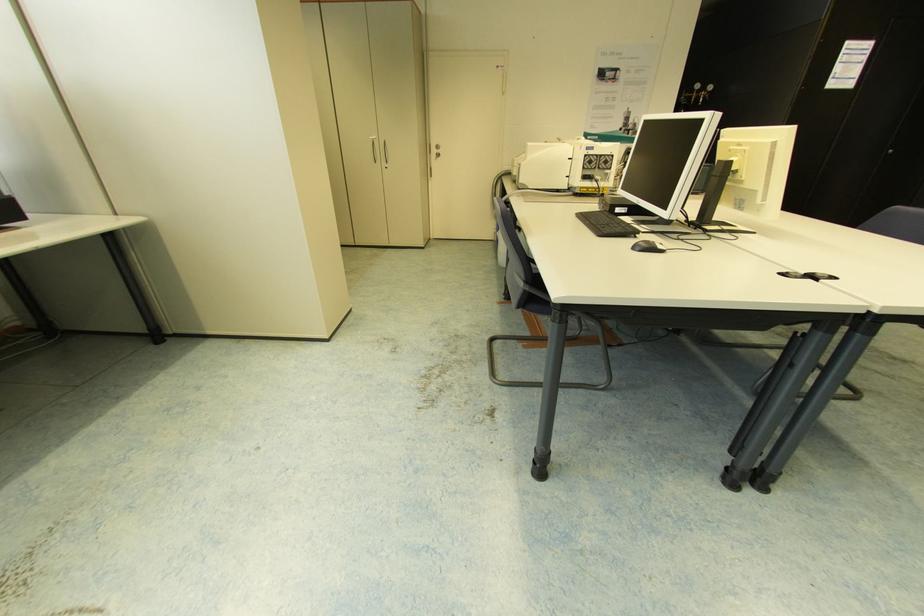
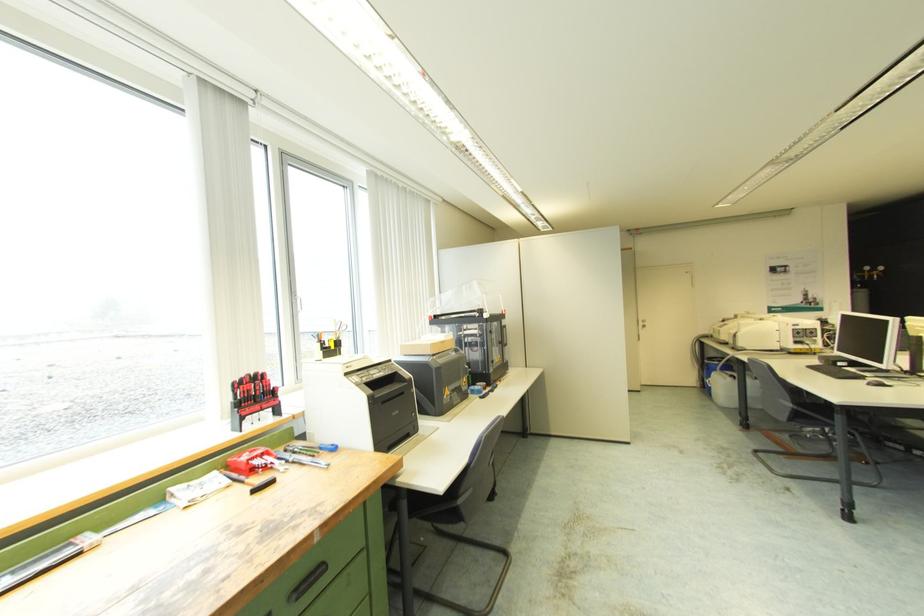
In the second image, find the point that corresponds to point (653, 249) in the first image.

(884, 386)